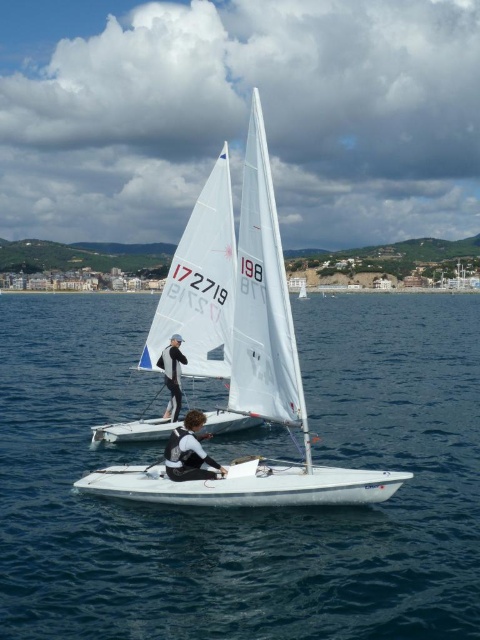
You are a drone operator trying to capture aerial footage of two points marked in the image. The first point is labeled as point (252,472) and the second is point (202,436). Since you want to ensure the closest point is in focus first, which point should you prioritize focusing on?

Point (252,472) is closer to the viewer than point (202,436), so you should prioritize focusing on point (252,472) first.

You are a photographer trying to capture a wide shot of the white glossy sailboat at center and the black wetsuit at center. If the sailboat is wider than the wetsuit, will you need to adjust your camera angle to include both in the frame?

The white glossy sailboat at center might be wider than black wetsuit at center, so you may need to adjust your camera angle to ensure both are fully visible in the frame.